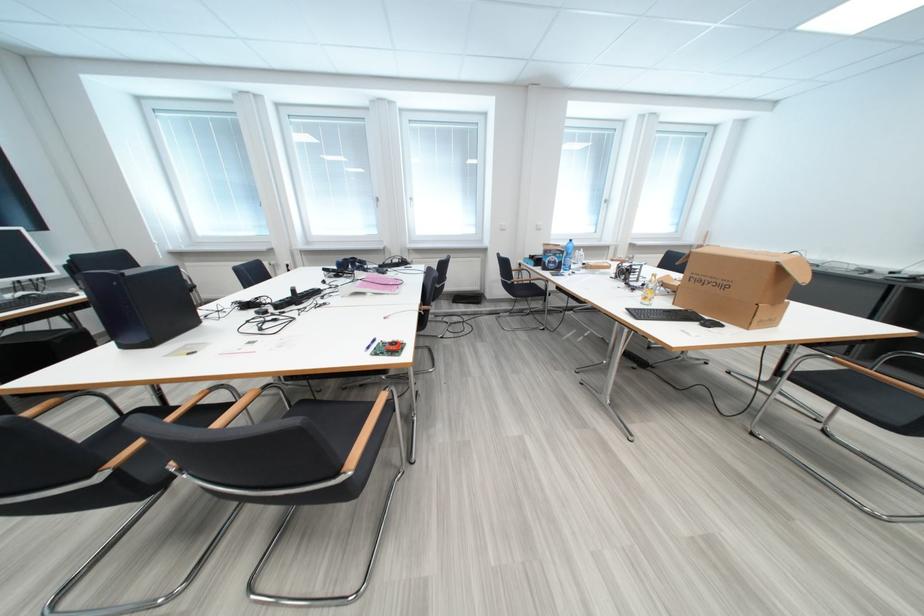
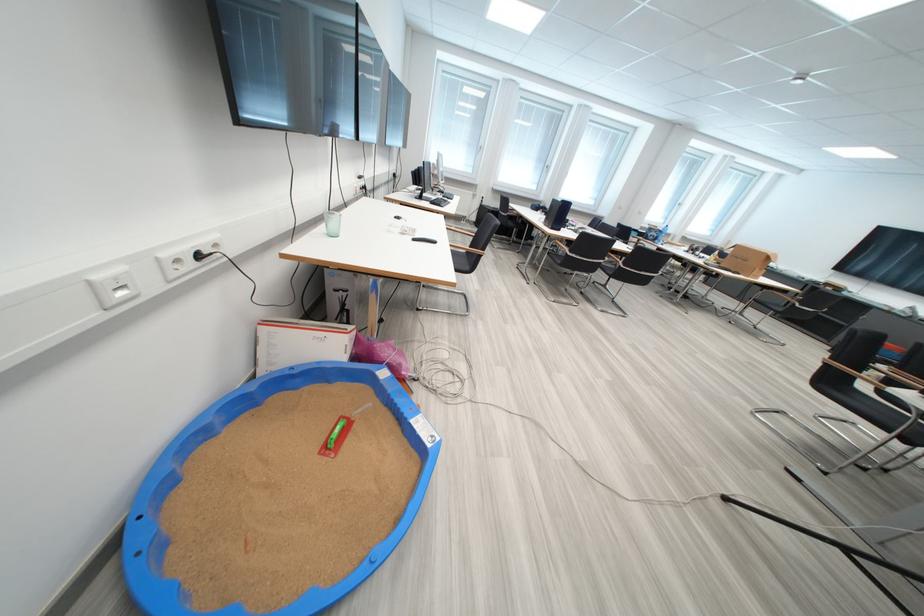
What movement of the cameraman would produce the second image?

The movement direction of the cameraman is left, backward.